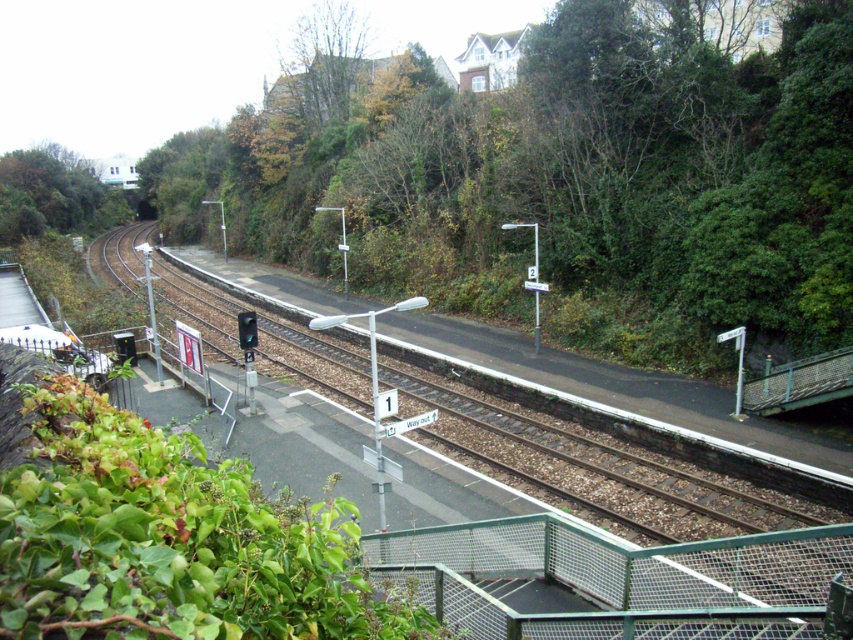
Does green leafy tree at center have a lesser width compared to green metallic track at lower left?

In fact, green leafy tree at center might be wider than green metallic track at lower left.

Does green leafy tree at center come in front of green metallic track at lower left?

No, it is behind green metallic track at lower left.

Is point (354, 180) closer to camera compared to point (805, 547)?

No, (354, 180) is further to viewer.

Identify the location of green leafy tree at center. The image size is (853, 640). (576, 184).

Is green metallic track at lower left above green leafy tree at upper left?

Incorrect, green metallic track at lower left is not positioned above green leafy tree at upper left.

What do you see at coordinates (639, 500) in the screenshot? The height and width of the screenshot is (640, 853). I see `green metallic track at lower left` at bounding box center [639, 500].

Locate an element on the screen. green metallic track at lower left is located at coordinates (639, 500).

Which is above, green metallic track at lower left or green leafy tree at upper center?

Positioned higher is green leafy tree at upper center.

Describe the element at coordinates (639, 500) in the screenshot. I see `green metallic track at lower left` at that location.

Which is behind, point (646, 492) or point (364, 72)?

Point (364, 72)

I want to click on green metallic track at lower left, so click(639, 500).